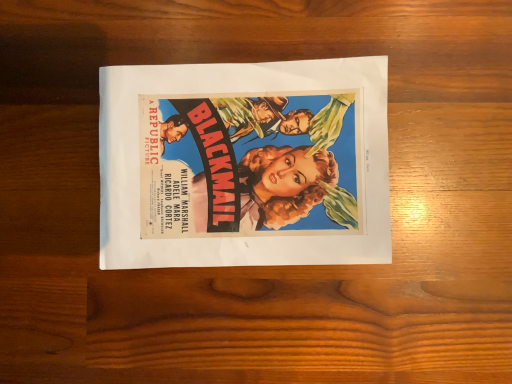
The height and width of the screenshot is (384, 512). What are the coordinates of `matte paper poster at center` in the screenshot? It's located at (244, 164).

This screenshot has width=512, height=384. What do you see at coordinates (244, 164) in the screenshot?
I see `matte paper poster at center` at bounding box center [244, 164].

You are a GUI agent. You are given a task and a screenshot of the screen. Output one action in this format:
    pyautogui.click(x=<x>, y=<y>)
    Task: Click on the matte paper poster at center
    The height and width of the screenshot is (384, 512).
    Given the screenshot: What is the action you would take?
    pyautogui.click(x=244, y=164)